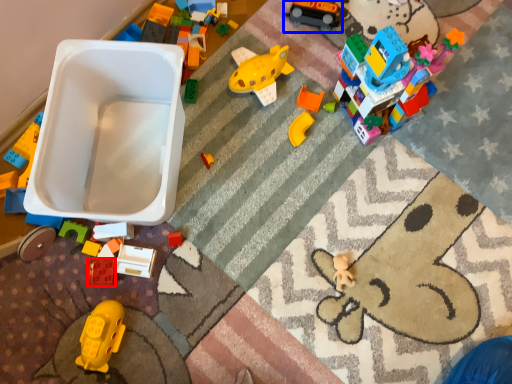
Question: Which point is closer to the camera, toy (highlighted by a red box) or toy (highlighted by a blue box)?

Choices:
 (A) toy
 (B) toy

Answer: (A)